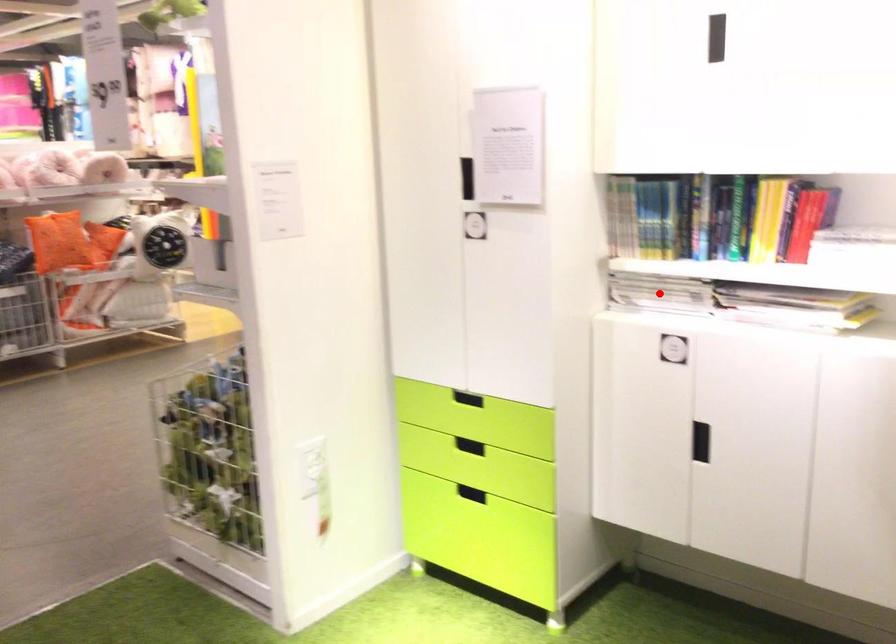
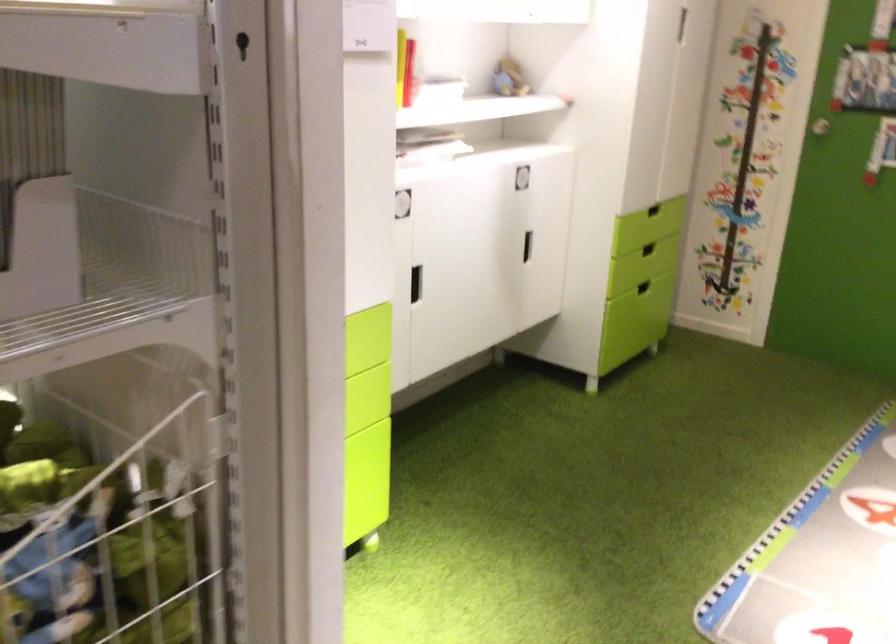
Question: I am providing you with two images of the same scene from different viewpoints. A red point is marked on the first image. Can you still see the location of the red point in image 2?

Choices:
 (A) Yes
 (B) No

Answer: (B)